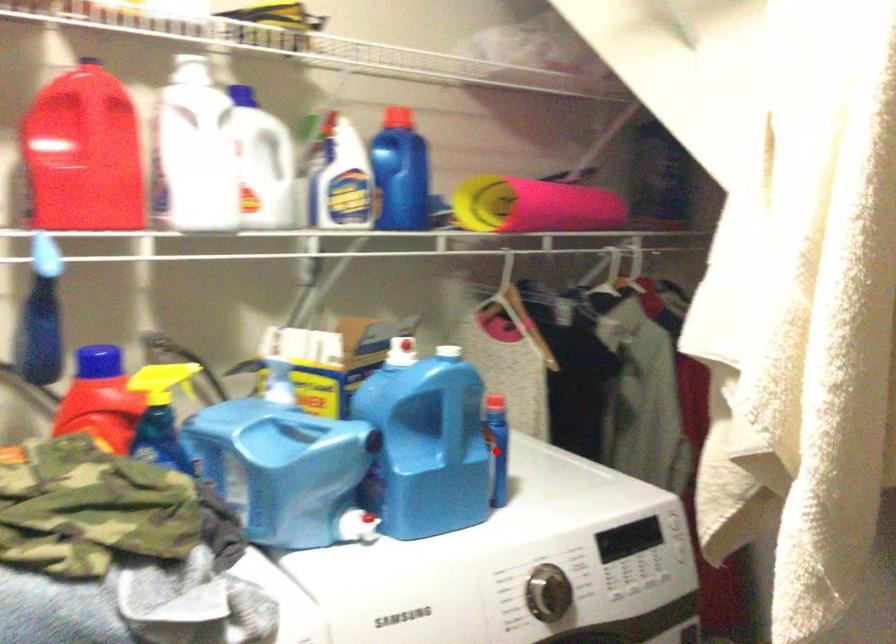
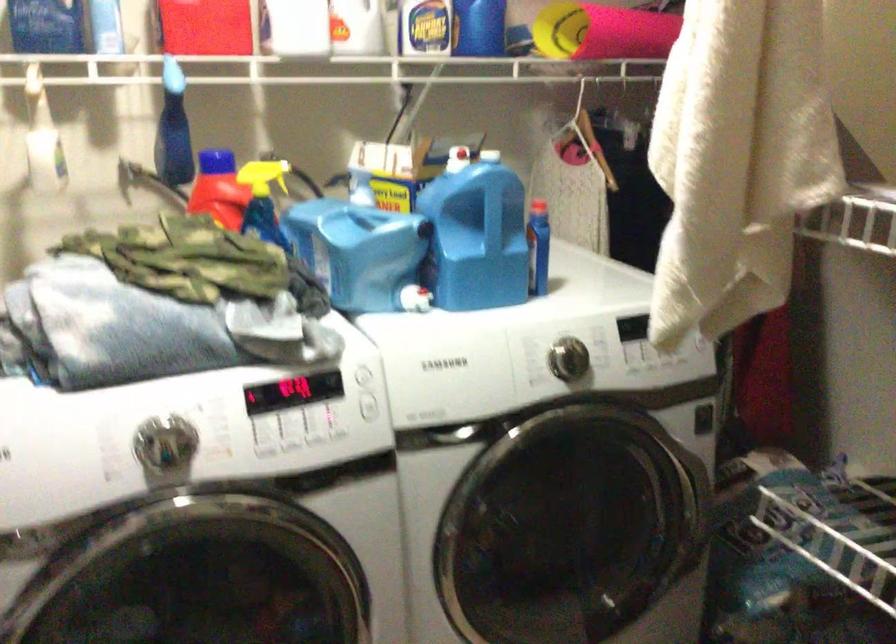
Question: I am providing you with two images of the same scene from different viewpoints. In image1, a red point is highlighted. Considering the same 3D point in image2, which of the following is correct?

Choices:
 (A) It is closer
 (B) It is farther

Answer: (B)